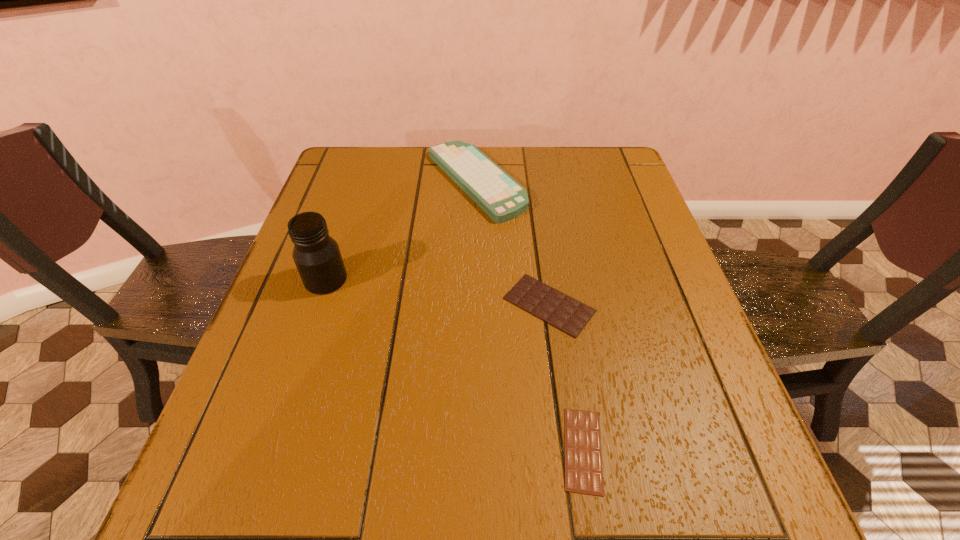
Find the location of a particular element. the leftmost object is located at coordinates (317, 256).

I want to click on jar, so click(x=317, y=256).

What are the coordinates of `the second tallest object` in the screenshot? It's located at (502, 198).

Image resolution: width=960 pixels, height=540 pixels. In order to click on computer keyboard in this screenshot , I will do `click(502, 198)`.

Where is `the farther chocolate bar`? Image resolution: width=960 pixels, height=540 pixels. the farther chocolate bar is located at coordinates (569, 315).

The image size is (960, 540). Identify the location of the second shortest object. (569, 315).

You are a GUI agent. You are given a task and a screenshot of the screen. Output one action in this format:
    pyautogui.click(x=<x>, y=<y>)
    Task: Click on the nearest object
    This screenshot has width=960, height=540.
    Given the screenshot: What is the action you would take?
    pyautogui.click(x=583, y=460)

Identify the location of the shortest object. (583, 460).

Where is `vacant space located on the right of the jar`? This screenshot has width=960, height=540. vacant space located on the right of the jar is located at coordinates (x=472, y=280).

At what (x,y) coordinates should I click in order to perform the action: click on vacant space situated on the left of the third shortest object. Please return your answer as a coordinate pair (x, y). Image resolution: width=960 pixels, height=540 pixels. Looking at the image, I should click on (330, 182).